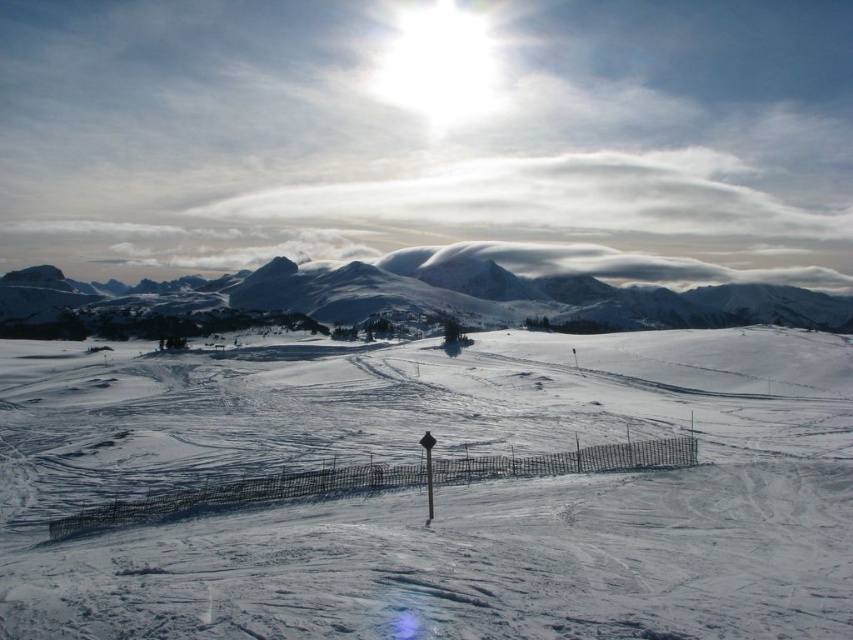
Can you confirm if white powdery snow at center is smaller than snowy mountain at upper center?

→ Correct, white powdery snow at center occupies less space than snowy mountain at upper center.

Looking at this image, can you confirm if white powdery snow at center is thinner than snowy mountain at upper center?

Correct, white powdery snow at center's width is less than snowy mountain at upper center's.

This screenshot has height=640, width=853. I want to click on white powdery snow at center, so click(442, 492).

This screenshot has width=853, height=640. Identify the location of white powdery snow at center. (442, 492).